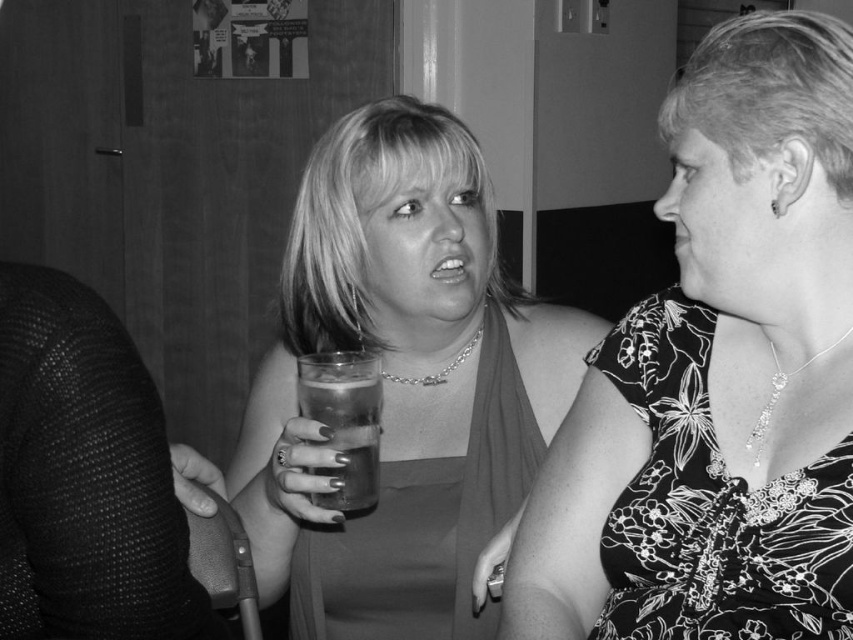
Question: Which of the following is the farthest from the observer?

Choices:
 (A) (326, 358)
 (B) (270, 508)
 (C) (680, 340)

Answer: (B)

Question: Is floral-patterned dress at center-right to the right of translucent glass at center from the viewer's perspective?

Choices:
 (A) no
 (B) yes

Answer: (B)

Question: Does smooth glass at center appear on the right side of translucent glass at center?

Choices:
 (A) yes
 (B) no

Answer: (A)

Question: Which point appears farthest from the camera in this image?

Choices:
 (A) (315, 497)
 (B) (492, 344)
 (C) (740, 502)

Answer: (B)

Question: Considering the relative positions of floral-patterned dress at center-right and translucent glass at center in the image provided, where is floral-patterned dress at center-right located with respect to translucent glass at center?

Choices:
 (A) below
 (B) above

Answer: (B)

Question: Which of the following is the closest to the observer?

Choices:
 (A) (648, 602)
 (B) (283, 340)

Answer: (A)